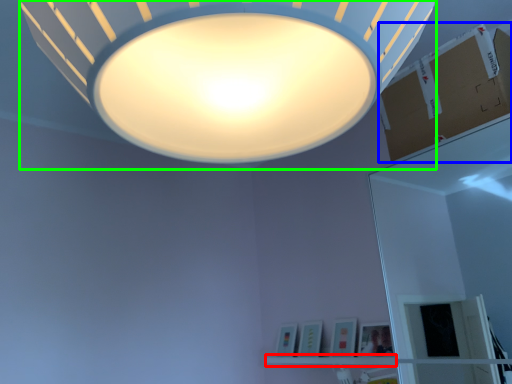
Question: Estimate the real-world distances between objects in this image. Which object is farther from shelf (highlighted by a red box), cardboard box (highlighted by a blue box) or lamp (highlighted by a green box)?

Choices:
 (A) cardboard box
 (B) lamp

Answer: (B)